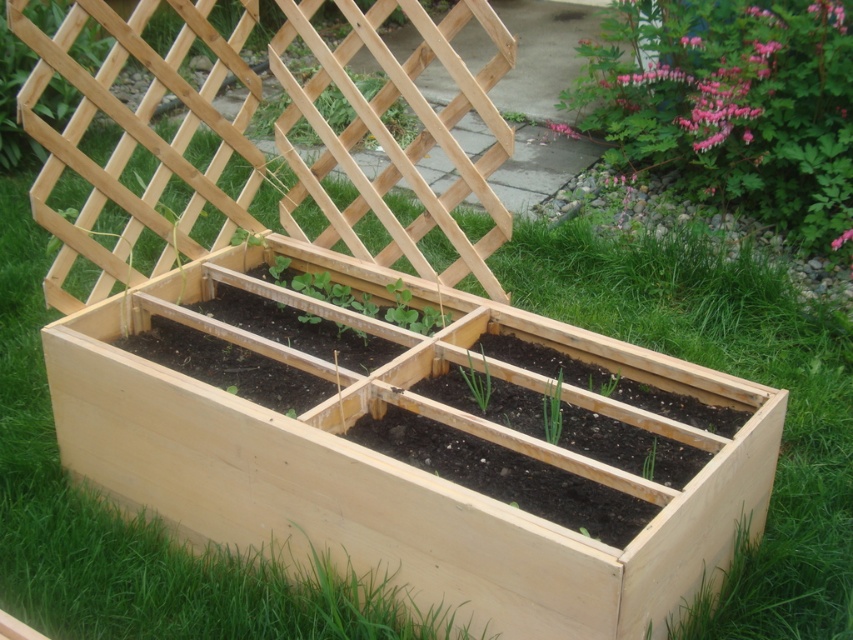
Between green matte onion at center and green matte plant at lower right, which one has less height?

With less height is green matte plant at lower right.

Who is taller, green matte onion at center or green matte plant at lower right?

green matte onion at center is taller.

This screenshot has height=640, width=853. I want to click on green matte onion at center, so click(x=477, y=381).

Does pink flower at upper right appear under green matte trellis at upper center?

Yes, pink flower at upper right is below green matte trellis at upper center.

Between pink flower at upper right and green matte trellis at upper center, which one is positioned lower?

pink flower at upper right is below.

Is point (844, 230) more distant than point (260, 128)?

That is False.

Identify the location of pink flower at upper right. The height and width of the screenshot is (640, 853). (730, 104).

Does point (703, 99) come farther from viewer compared to point (463, 372)?

Yes.

Can you confirm if pink flower at upper right is bigger than green matte onion at center?

Yes, pink flower at upper right is bigger than green matte onion at center.

What are the coordinates of `pink flower at upper right` in the screenshot? It's located at (730, 104).

Image resolution: width=853 pixels, height=640 pixels. Find the location of `pink flower at upper right`. pink flower at upper right is located at coordinates (730, 104).